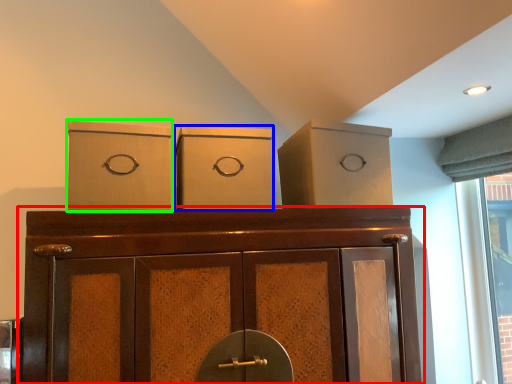
Question: Which is farther away from cupboard (highlighted by a red box)? cardboard box (highlighted by a blue box) or cardboard box (highlighted by a green box)?

Choices:
 (A) cardboard box
 (B) cardboard box

Answer: (B)